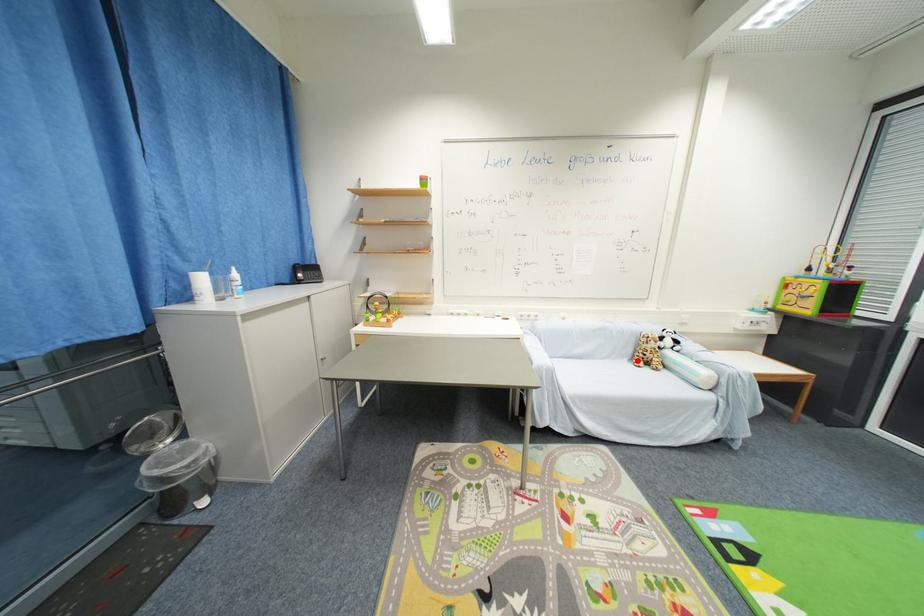
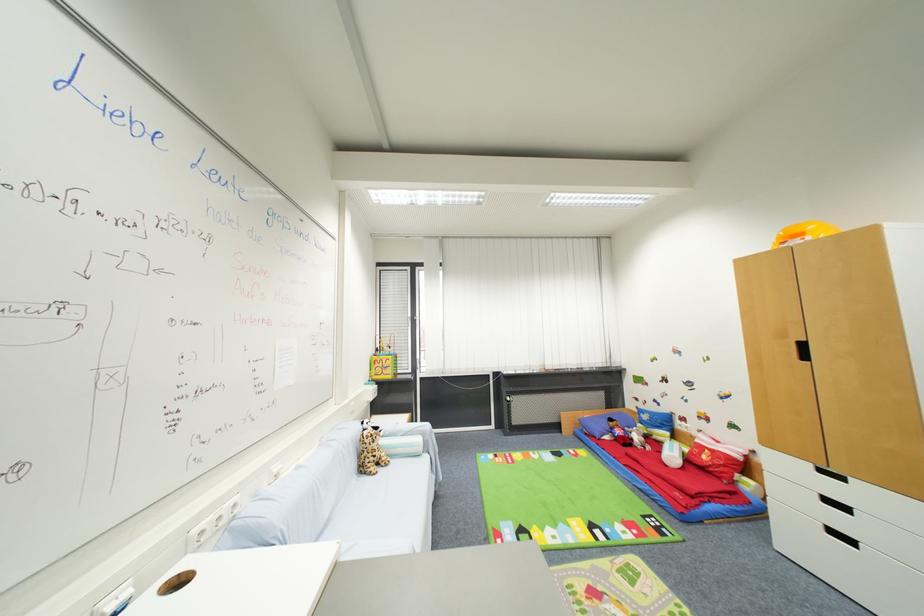
In the second image, find the point that corresponds to the highlighted location in the first image.

(367, 472)